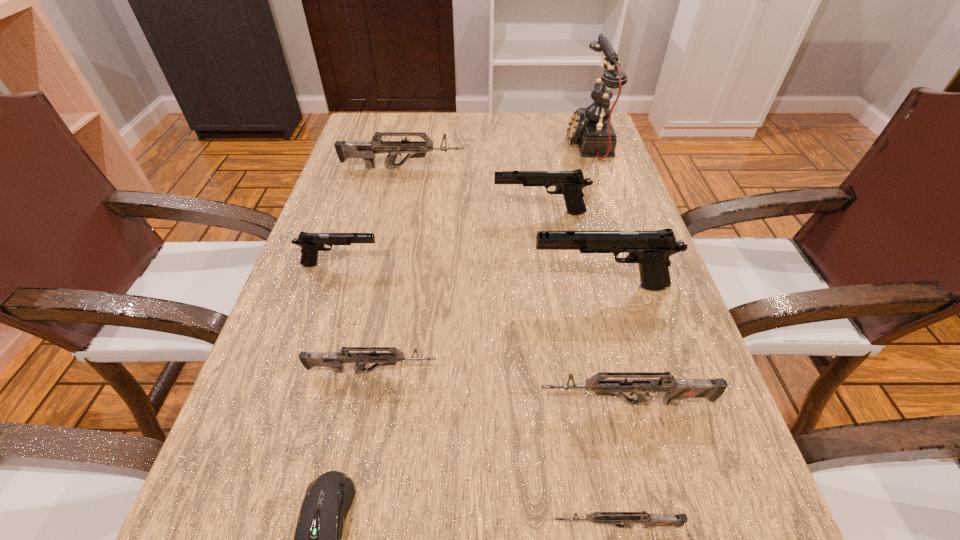
Locate an element on the screen. This screenshot has height=540, width=960. telephone is located at coordinates (591, 127).

This screenshot has width=960, height=540. What are the coordinates of `the tallest object` in the screenshot? It's located at (591, 127).

Locate an element on the screen. This screenshot has height=540, width=960. the second tallest object is located at coordinates (651, 250).

This screenshot has width=960, height=540. Identify the location of the tallest gun. (651, 250).

Locate an element on the screen. This screenshot has width=960, height=540. the second biggest black gun is located at coordinates (570, 183).

Identify the location of the farthest black gun. The image size is (960, 540). (570, 183).

Image resolution: width=960 pixels, height=540 pixels. I want to click on the biggest grey gun, so click(x=366, y=150).

Locate an element on the screen. The image size is (960, 540). the farthest gun is located at coordinates 366,150.

Locate an element on the screen. the sixth nearest object is located at coordinates point(311,243).

You are a GUI agent. You are given a task and a screenshot of the screen. Output one action in this format:
    pyautogui.click(x=<x>, y=<y>)
    Task: Click on the smallest black gun
    This screenshot has width=960, height=540.
    Given the screenshot: What is the action you would take?
    pyautogui.click(x=311, y=243)